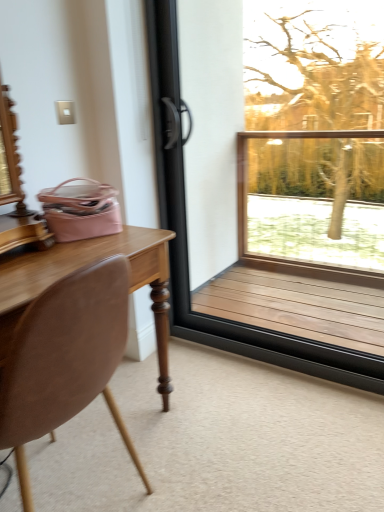
What do you see at coordinates (67, 355) in the screenshot? I see `brown leather chair at left` at bounding box center [67, 355].

In order to face brown leather chair at left, should I rotate leftwards or rightwards?

To align with it, rotate left about 19.075°.

You are a GUI agent. You are given a task and a screenshot of the screen. Output one action in this format:
    pyautogui.click(x=<x>, y=<y>)
    Task: Click on the brown leather chair at left
    Image resolution: width=384 pixels, height=512 pixels.
    Given the screenshot: What is the action you would take?
    pyautogui.click(x=67, y=355)

Describe the element at coordinates (186, 245) in the screenshot. I see `brown wooden window at right` at that location.

The image size is (384, 512). I want to click on brown wooden window at right, so click(x=186, y=245).

Measure the distance between point (179,94) and camera.

They are 6.77 feet apart.

What are the coordinates of `brown leather chair at left` in the screenshot? It's located at (67, 355).

Considering the positions of objects brown wooden window at right and brown leather chair at left in the image provided, who is more to the left, brown wooden window at right or brown leather chair at left?

From the viewer's perspective, brown leather chair at left appears more on the left side.

Is the position of brown wooden window at right more distant than that of brown leather chair at left?

Yes, brown wooden window at right is further from the camera.

Does point (174, 305) come in front of point (127, 434)?

No, it is behind (127, 434).

From the image's perspective, would you say brown wooden window at right is shown under brown leather chair at left?

No, from the image's perspective, brown wooden window at right is not below brown leather chair at left.

From a real-world perspective, is brown wooden window at right positioned over brown leather chair at left based on gravity?

Correct, in the physical world, brown wooden window at right is higher than brown leather chair at left.

Is brown wooden window at right wider than brown leather chair at left?

No.

Between brown wooden window at right and brown leather chair at left, which one has less height?

brown leather chair at left is shorter.

Between brown wooden window at right and brown leather chair at left, which one has smaller size?

brown wooden window at right.

Is brown wooden window at right located outside brown leather chair at left?

Yes, brown wooden window at right is outside of brown leather chair at left.

Is brown wooden window at right with brown leather chair at left?

No, brown wooden window at right is not touching brown leather chair at left.

Is brown wooden window at right turned away from brown leather chair at left?

No, brown wooden window at right is not facing away from brown leather chair at left.

How far apart are brown wooden window at right and brown leather chair at left?

A distance of 1.07 meters exists between brown wooden window at right and brown leather chair at left.

I want to click on window above the brown leather chair at left (from the image's perspective), so click(x=186, y=245).

Between brown leather chair at left and brown wooden window at right, which one appears on the right side from the viewer's perspective?

From the viewer's perspective, brown wooden window at right appears more on the right side.

Which is behind, brown leather chair at left or brown wooden window at right?

brown wooden window at right is more distant.

Based on the photo, which point is more forward, (108, 373) or (260, 328)?

Positioned in front is point (108, 373).

From the image's perspective, which is below, brown leather chair at left or brown wooden window at right?

From the image's view, brown leather chair at left is below.

From a real-world perspective, which object stands above the other?

In real-world perspective, brown wooden window at right is above.

Between brown leather chair at left and brown wooden window at right, which one has smaller width?

Thinner between the two is brown wooden window at right.

In terms of height, does brown leather chair at left look taller or shorter compared to brown wooden window at right?

Considering their sizes, brown leather chair at left has less height than brown wooden window at right.

Is brown leather chair at left bigger or smaller than brown wooden window at right?

Clearly, brown leather chair at left is larger in size than brown wooden window at right.

Is brown wooden window at right surrounded by brown leather chair at left?

No.

Is brown leather chair at left far away from brown wooden window at right?

That's right, there is a large distance between brown leather chair at left and brown wooden window at right.

Is brown leather chair at left facing away from brown wooden window at right?

No, brown leather chair at left's orientation is not away from brown wooden window at right.

How distant is brown leather chair at left from brown wooden window at right?

brown leather chair at left and brown wooden window at right are 1.07 meters apart.

Where is `window above the brown leather chair at left (from a real-world perspective)`? The height and width of the screenshot is (512, 384). window above the brown leather chair at left (from a real-world perspective) is located at coordinates (186, 245).

The height and width of the screenshot is (512, 384). Identify the location of window that appears on the right of brown leather chair at left. (186, 245).

You are a GUI agent. You are given a task and a screenshot of the screen. Output one action in this format:
    pyautogui.click(x=<x>, y=<y>)
    Task: Click on the chair below the brown wooden window at right (from a real-world perspective)
    This screenshot has width=384, height=512.
    Given the screenshot: What is the action you would take?
    pyautogui.click(x=67, y=355)